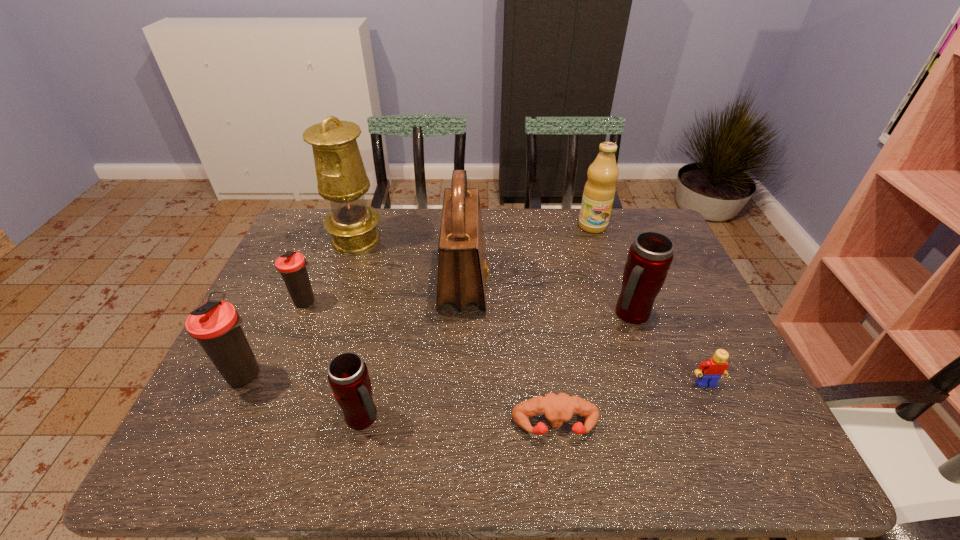
The width and height of the screenshot is (960, 540). Find the location of `the nearest thermos bottle`. the nearest thermos bottle is located at coordinates (348, 376).

Image resolution: width=960 pixels, height=540 pixels. What are the coordinates of `the rightmost object` in the screenshot? It's located at (710, 371).

Where is `Lego`? Lego is located at coordinates (710, 371).

This screenshot has height=540, width=960. What are the coordinates of `the shortest object` in the screenshot? It's located at (557, 409).

This screenshot has height=540, width=960. Identify the location of the sixth object from left to right. (557, 409).

This screenshot has width=960, height=540. I want to click on vacant space situated on the right of the oil lamp, so click(422, 239).

Image resolution: width=960 pixels, height=540 pixels. I want to click on free location located on the front flap of the shoulder bag, so click(618, 284).

Find the location of a particular element. blank space located 0.300m on the label of the seventh shortest object is located at coordinates (615, 298).

You are a GUI agent. You are given a task and a screenshot of the screen. Output one action in this format:
    pyautogui.click(x=<x>, y=<y>)
    Task: Click on the free spot located on the side with the handle of the right red thermos bottle
    
    Given the screenshot: What is the action you would take?
    pyautogui.click(x=681, y=455)

I want to click on free location located on the right of the third farthest thermos bottle, so click(x=390, y=373).